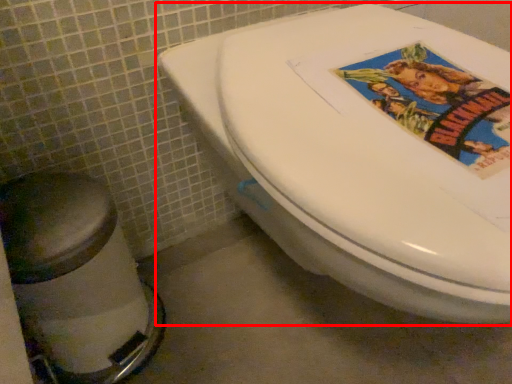
Question: From the image's perspective, what is the correct spatial relationship of toilet (annotated by the red box) in relation to bidet?

Choices:
 (A) above
 (B) below

Answer: (A)